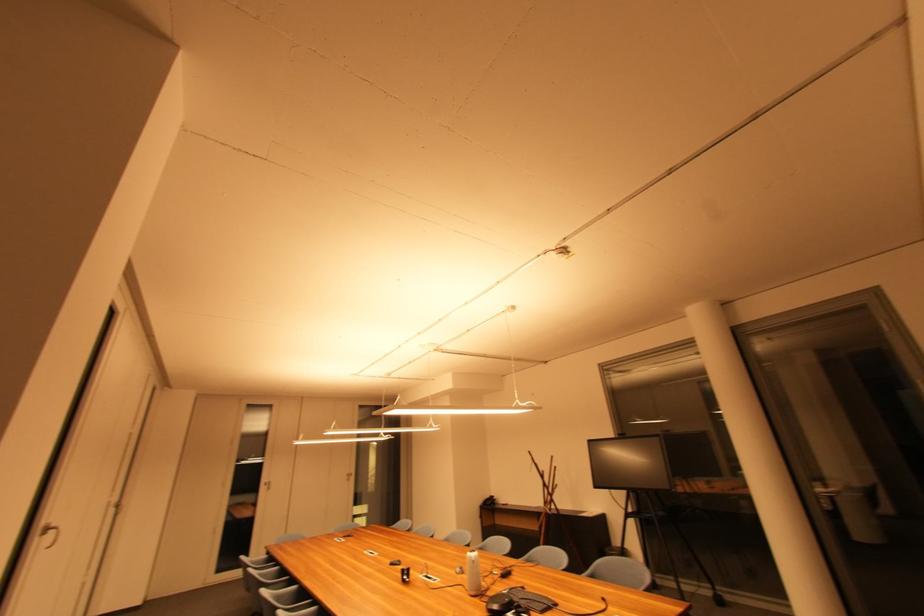
Where would you pull the small cabinet handle? Please return your answer as a coordinate pair (x, y).

(265, 485)